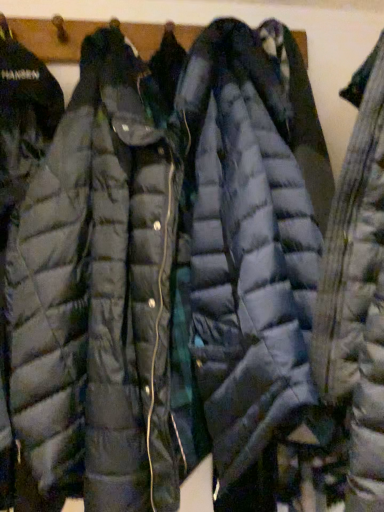
The height and width of the screenshot is (512, 384). What do you see at coordinates (357, 291) in the screenshot?
I see `gray quilted jacket at center` at bounding box center [357, 291].

What are the coordinates of `gray quilted jacket at center` in the screenshot? It's located at (357, 291).

This screenshot has height=512, width=384. Find the location of `gray quilted jacket at center`. gray quilted jacket at center is located at coordinates (357, 291).